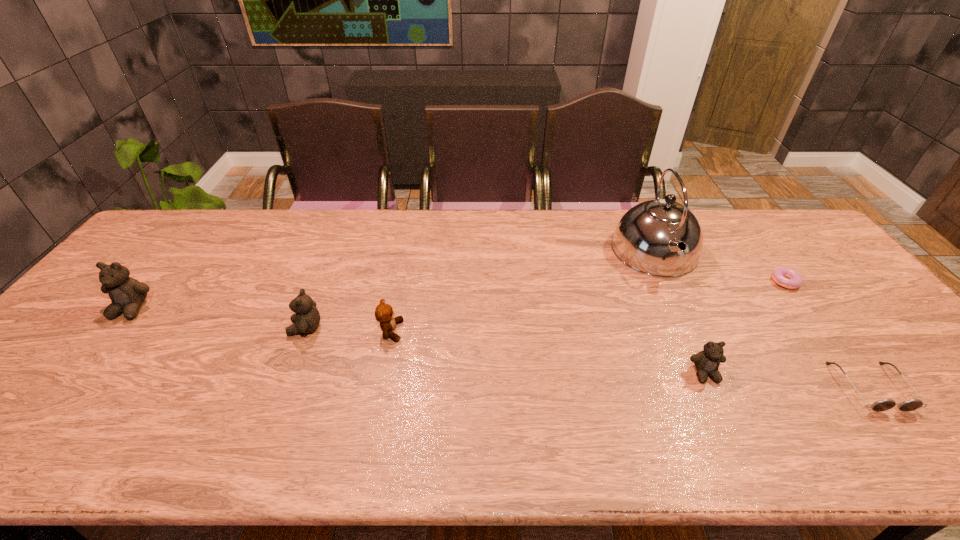
At what (x,y) coordinates should I click in order to perform the action: click on the second tallest object. Please return your answer as a coordinate pair (x, y). The image size is (960, 540). Looking at the image, I should click on (127, 294).

Identify the location of the tallest teddy bear. Image resolution: width=960 pixels, height=540 pixels. (127, 294).

Locate an element on the screen. the third shortest teddy bear is located at coordinates (307, 317).

You are a GUI agent. You are given a task and a screenshot of the screen. Output one action in this format:
    pyautogui.click(x=<x>, y=<y>)
    Task: Click on the second object from left to right
    Image resolution: width=960 pixels, height=540 pixels.
    Given the screenshot: What is the action you would take?
    pyautogui.click(x=307, y=317)

You are a GUI agent. You are given a task and a screenshot of the screen. Output one action in this format:
    pyautogui.click(x=<x>, y=<y>)
    Task: Click on the rightmost teddy bear
    The image size is (960, 540).
    Given the screenshot: What is the action you would take?
    pyautogui.click(x=707, y=362)

You are a GUI agent. You are given a task and a screenshot of the screen. Output one action in this format:
    pyautogui.click(x=<x>, y=<y>)
    Task: Click on the shortest object
    The width and height of the screenshot is (960, 540).
    Given the screenshot: What is the action you would take?
    pyautogui.click(x=785, y=277)

I want to click on the tallest object, so click(x=646, y=238).

Identify the location of the third object from left to right. The width and height of the screenshot is (960, 540). (384, 314).

This screenshot has height=540, width=960. Identify the location of sunglasses. (882, 405).

Locate an element on the screen. This screenshot has width=960, height=540. vacant space located 0.220m on the face of the leftmost teddy bear is located at coordinates (62, 394).